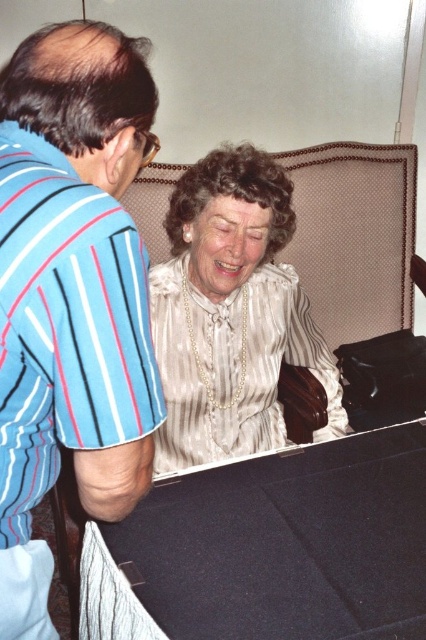
Between point (233, 525) and point (212, 460), which one is positioned in front?

Point (233, 525) is more forward.

Does black felt table at lower center have a smaller size compared to white satin blouse at center?

Correct, black felt table at lower center occupies less space than white satin blouse at center.

Is point (423, 484) closer to camera compared to point (253, 419)?

Yes, it is.

Locate an element on the screen. This screenshot has height=640, width=426. black felt table at lower center is located at coordinates (270, 548).

Is point (95, 440) positioned before point (383, 525)?

Yes, point (95, 440) is closer to viewer.

Based on the photo, who is positioned more to the right, blue striped shirt at left or black felt table at lower center?

From the viewer's perspective, black felt table at lower center appears more on the right side.

Where is `blue striped shirt at left`? blue striped shirt at left is located at coordinates (71, 292).

Who is lower down, blue striped shirt at left or white satin blouse at center?

blue striped shirt at left is below.

Locate an element on the screen. This screenshot has width=426, height=640. blue striped shirt at left is located at coordinates (71, 292).

At what (x,y) coordinates should I click in order to perform the action: click on blue striped shirt at left. Please return your answer as a coordinate pair (x, y). This screenshot has height=640, width=426. Looking at the image, I should click on (71, 292).

Where is `blue striped shirt at left`? The image size is (426, 640). blue striped shirt at left is located at coordinates (71, 292).